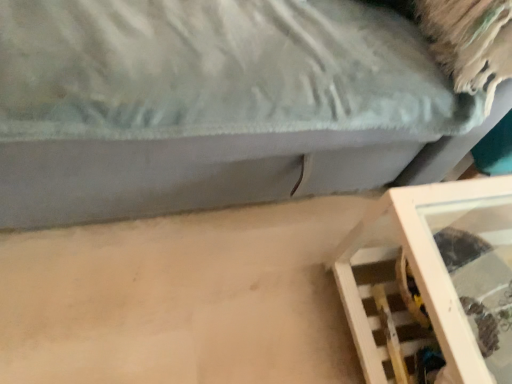
Question: Is wooden shelf at lower right, which is the first furniture from bottom to top, at the left side of wooden frame at lower right, the second furniture in the bottom-to-top sequence?

Choices:
 (A) no
 (B) yes

Answer: (A)

Question: Is wooden frame at lower right, which appears as the 1th furniture when viewed from the top, surrounded by wooden shelf at lower right, the 2th furniture from the top?

Choices:
 (A) yes
 (B) no

Answer: (B)

Question: Can you confirm if wooden shelf at lower right, the 2th furniture from the top, is positioned to the right of wooden frame at lower right, the second furniture in the bottom-to-top sequence?

Choices:
 (A) no
 (B) yes

Answer: (B)

Question: From the image's perspective, is wooden shelf at lower right, which is the first furniture from bottom to top, beneath wooden frame at lower right, the second furniture in the bottom-to-top sequence?

Choices:
 (A) no
 (B) yes

Answer: (B)

Question: Can you confirm if wooden shelf at lower right, the 2th furniture from the top, is shorter than wooden frame at lower right, the second furniture in the bottom-to-top sequence?

Choices:
 (A) no
 (B) yes

Answer: (B)

Question: Is the depth of wooden shelf at lower right, the 2th furniture from the top, greater than that of wooden frame at lower right, the second furniture in the bottom-to-top sequence?

Choices:
 (A) no
 (B) yes

Answer: (B)

Question: From a real-world perspective, is wooden frame at lower right, the second furniture in the bottom-to-top sequence, physically above wooden shelf at lower right, which is the first furniture from bottom to top?

Choices:
 (A) yes
 (B) no

Answer: (A)

Question: Is wooden frame at lower right, the second furniture in the bottom-to-top sequence, facing towards wooden shelf at lower right, which is the first furniture from bottom to top?

Choices:
 (A) no
 (B) yes

Answer: (B)

Question: Can you confirm if wooden frame at lower right, which appears as the 1th furniture when viewed from the top, is smaller than wooden shelf at lower right, which is the first furniture from bottom to top?

Choices:
 (A) no
 (B) yes

Answer: (A)

Question: From the image's perspective, is wooden frame at lower right, the second furniture in the bottom-to-top sequence, above wooden shelf at lower right, which is the first furniture from bottom to top?

Choices:
 (A) no
 (B) yes

Answer: (B)

Question: Considering the relative sizes of wooden frame at lower right, the second furniture in the bottom-to-top sequence, and wooden shelf at lower right, which is the first furniture from bottom to top, in the image provided, is wooden frame at lower right, the second furniture in the bottom-to-top sequence, shorter than wooden shelf at lower right, which is the first furniture from bottom to top,?

Choices:
 (A) yes
 (B) no

Answer: (B)

Question: Considering the relative positions of wooden frame at lower right, which appears as the 1th furniture when viewed from the top, and wooden shelf at lower right, the 2th furniture from the top, in the image provided, is wooden frame at lower right, which appears as the 1th furniture when viewed from the top, behind wooden shelf at lower right, the 2th furniture from the top,?

Choices:
 (A) yes
 (B) no

Answer: (B)

Question: From a real-world perspective, is wooden frame at lower right, the second furniture in the bottom-to-top sequence, positioned above or below wooden shelf at lower right, the 2th furniture from the top?

Choices:
 (A) below
 (B) above

Answer: (B)